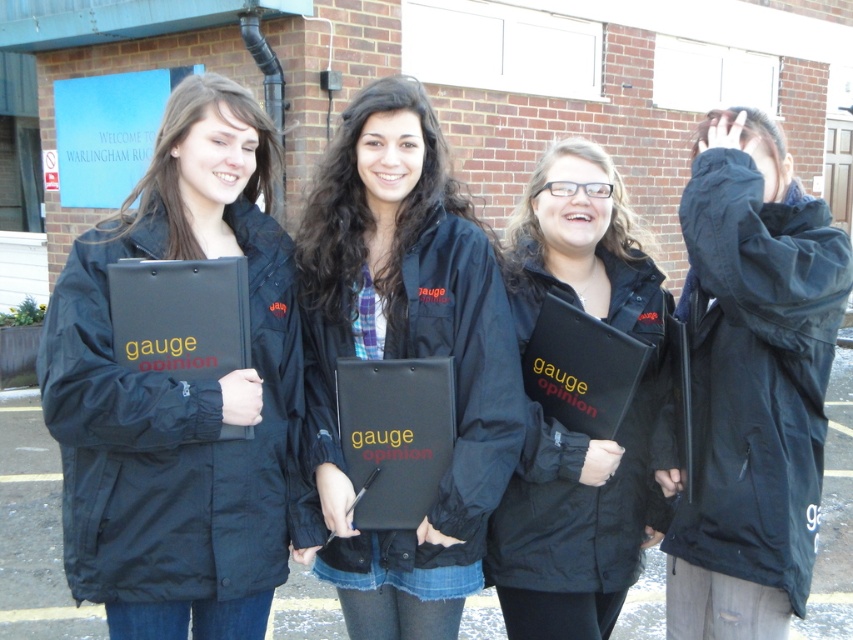
Can you confirm if matte black clipboard at left is positioned below black matte jacket at center?

Actually, matte black clipboard at left is above black matte jacket at center.

This screenshot has width=853, height=640. What do you see at coordinates (183, 396) in the screenshot?
I see `matte black clipboard at left` at bounding box center [183, 396].

This screenshot has height=640, width=853. What are the coordinates of `matte black clipboard at left` in the screenshot? It's located at (183, 396).

Consider the image. Who is higher up, matte black clipboard at left or matte black folder at center?

matte black clipboard at left

Is point (207, 474) in front of point (599, 468)?

Yes, point (207, 474) is in front of point (599, 468).

Does point (300, 396) come farther from viewer compared to point (566, 214)?

No, (300, 396) is closer to viewer.

Where is `matte black clipboard at left`? matte black clipboard at left is located at coordinates (183, 396).

Is black matte jacket at center to the right of black matte jacket at right from the viewer's perspective?

No, black matte jacket at center is not to the right of black matte jacket at right.

Locate an element on the screen. The height and width of the screenshot is (640, 853). black matte jacket at center is located at coordinates pos(405,355).

Locate an element on the screen. This screenshot has width=853, height=640. black matte jacket at center is located at coordinates (405, 355).